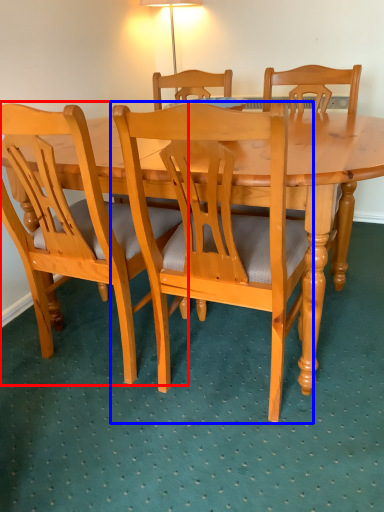
Question: Among these objects, which one is farthest to the camera, chair (highlighted by a red box) or chair (highlighted by a blue box)?

Choices:
 (A) chair
 (B) chair

Answer: (A)